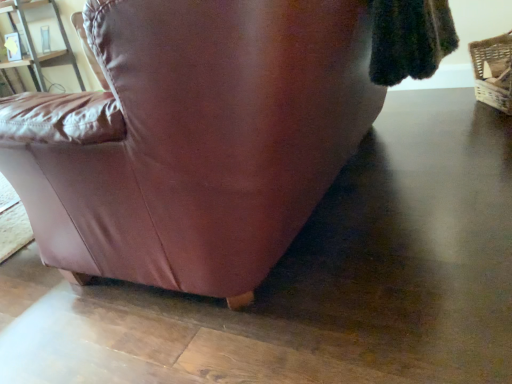
In the scene shown: What is the approximate width of woven straw basket at right?

woven straw basket at right is 11.98 inches wide.

The width and height of the screenshot is (512, 384). What do you see at coordinates (493, 71) in the screenshot? I see `woven straw basket at right` at bounding box center [493, 71].

Locate an element on the screen. The width and height of the screenshot is (512, 384). woven straw basket at right is located at coordinates (493, 71).

You are a GUI agent. You are given a task and a screenshot of the screen. Output one action in this format:
    pyautogui.click(x=<x>, y=<y>)
    Task: Click on the matte wood shelf at upper left
    This screenshot has height=384, width=512.
    Given the screenshot: What is the action you would take?
    pyautogui.click(x=34, y=46)

The image size is (512, 384). Describe the element at coordinates (34, 46) in the screenshot. I see `matte wood shelf at upper left` at that location.

Locate an element on the screen. The image size is (512, 384). woven straw basket at right is located at coordinates (493, 71).

Which object is positioned more to the left, matte wood shelf at upper left or woven straw basket at right?

matte wood shelf at upper left is more to the left.

Between matte wood shelf at upper left and woven straw basket at right, which one is positioned behind?

Positioned behind is matte wood shelf at upper left.

Does point (7, 13) lie in front of point (498, 48)?

No, it is not.

From the image's perspective, which one is positioned higher, matte wood shelf at upper left or woven straw basket at right?

matte wood shelf at upper left, from the image's perspective.

From a real-world perspective, which object rests below the other?

In real-world perspective, woven straw basket at right is lower.

Between matte wood shelf at upper left and woven straw basket at right, which one has larger width?

Wider between the two is matte wood shelf at upper left.

Between matte wood shelf at upper left and woven straw basket at right, which one has less height?

With less height is woven straw basket at right.

Which of these two, matte wood shelf at upper left or woven straw basket at right, is smaller?

woven straw basket at right.

Would you say matte wood shelf at upper left contains woven straw basket at right?

Definitely not — woven straw basket at right is not inside matte wood shelf at upper left.

Is matte wood shelf at upper left far away from woven straw basket at right?

Yes.

Is matte wood shelf at upper left turned away from woven straw basket at right?

matte wood shelf at upper left does not have its back to woven straw basket at right.

Locate an element on the screen. This screenshot has height=384, width=512. shelf above the woven straw basket at right (from a real-world perspective) is located at coordinates (34, 46).

Based on their positions, is woven straw basket at right located to the left or right of matte wood shelf at upper left?

From the image, it's evident that woven straw basket at right is to the right of matte wood shelf at upper left.

Considering the relative positions of woven straw basket at right and matte wood shelf at upper left in the image provided, is woven straw basket at right behind matte wood shelf at upper left?

No, it is in front of matte wood shelf at upper left.

Does point (490, 89) appear closer or farther from the camera than point (32, 69)?

Point (490, 89) appears to be closer to the viewer than point (32, 69).

From the image's perspective, which one is positioned lower, woven straw basket at right or matte wood shelf at upper left?

From the image's view, woven straw basket at right is below.

From a real-world perspective, is woven straw basket at right positioned over matte wood shelf at upper left based on gravity?

Incorrect, from a real-world perspective, woven straw basket at right is lower than matte wood shelf at upper left.

Considering the sizes of objects woven straw basket at right and matte wood shelf at upper left in the image provided, who is thinner, woven straw basket at right or matte wood shelf at upper left?

woven straw basket at right is thinner.

Is woven straw basket at right shorter than matte wood shelf at upper left?

Yes, woven straw basket at right is shorter than matte wood shelf at upper left.

Which of these two, woven straw basket at right or matte wood shelf at upper left, is smaller?

woven straw basket at right.

Would you say woven straw basket at right is inside or outside matte wood shelf at upper left?

woven straw basket at right exists outside the volume of matte wood shelf at upper left.

Are woven straw basket at right and matte wood shelf at upper left far apart?

Yes, woven straw basket at right and matte wood shelf at upper left are located far from each other.

Is woven straw basket at right looking in the opposite direction of matte wood shelf at upper left?

No, woven straw basket at right's orientation is not away from matte wood shelf at upper left.

Identify the location of basket on the right of matte wood shelf at upper left. This screenshot has height=384, width=512. (493, 71).

I want to click on basket in front of the matte wood shelf at upper left, so click(x=493, y=71).

This screenshot has height=384, width=512. I want to click on basket below the matte wood shelf at upper left (from the image's perspective), so click(x=493, y=71).